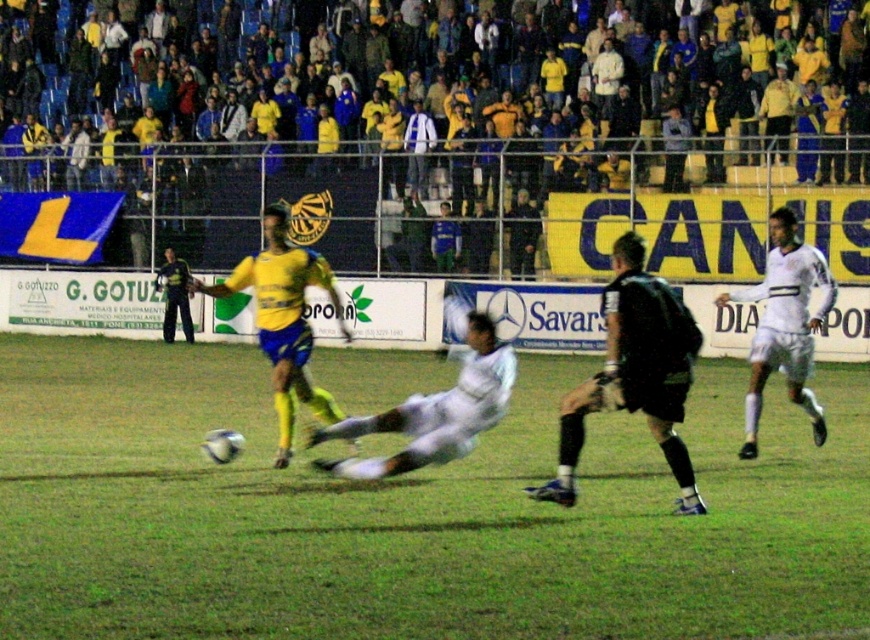
Question: Which of these objects is positioned closest to the matte black goalkeeper at left?

Choices:
 (A) white matte jersey at center
 (B) yellow/yellowish fabric at upper center
 (C) green grass at center

Answer: (B)

Question: Can you confirm if yellow/yellowish fabric at upper center is smaller than white matte jersey at right?

Choices:
 (A) no
 (B) yes

Answer: (A)

Question: Estimate the real-world distances between objects in this image. Which object is farther from the dark blue jersey at upper center?

Choices:
 (A) white matte jersey at center
 (B) yellow matte jersey at center
 (C) black matte jersey at center

Answer: (C)

Question: Can you confirm if yellow/yellowish fabric at upper center is positioned to the right of dark blue jersey at upper center?

Choices:
 (A) no
 (B) yes

Answer: (A)

Question: Does yellow/yellowish fabric at upper center come in front of matte black goalkeeper at left?

Choices:
 (A) yes
 (B) no

Answer: (A)

Question: Among these points, which one is farthest from the camera?

Choices:
 (A) (166, 291)
 (B) (621, 314)
 (C) (768, 129)
 (D) (477, 429)

Answer: (A)